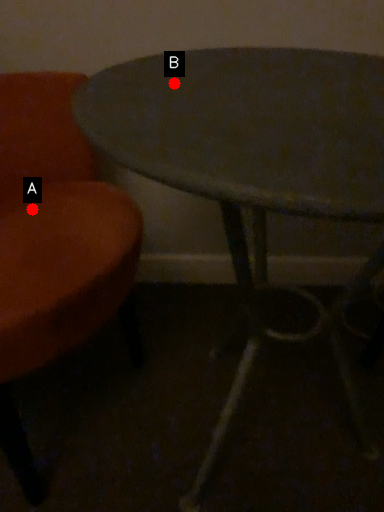
Question: Two points are circled on the image, labeled by A and B beside each circle. Which point is farther to the camera?

Choices:
 (A) A is further
 (B) B is further

Answer: (A)